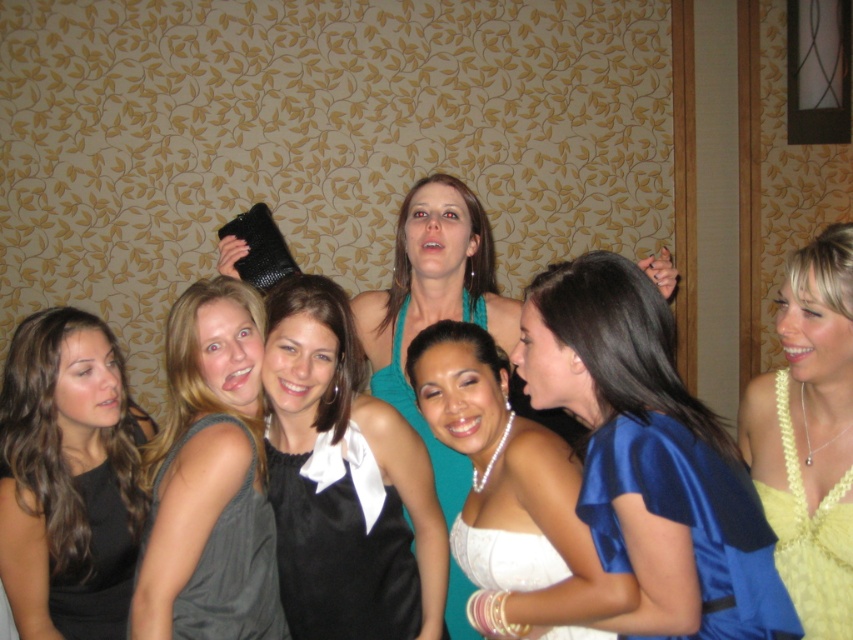
You are a photographer setting up for a group photo. You need to ensure that the distance between the satin blue dress at center and the yellow knitted dress at upper right is at least 14 inches to avoid overlapping in the frame. Based on the current setup, will this requirement be met?

The satin blue dress at center is 12.91 inches from the yellow knitted dress at upper right, which is less than the required 14 inches. Therefore, the distance is insufficient, and the requirement will not be met.

In the scene shown: You are a photographer setting up for a group photo. You notice a pearl necklace at center in the image. Based on its position, can you determine if it is positioned to the left or right of the center point of the image?

The pearl necklace at center is located at point coordinates approximately 0.777 on the x axis and 0.599 on the y axis. Since the x coordinate is greater than 0.5, it is positioned to the right of the image center.